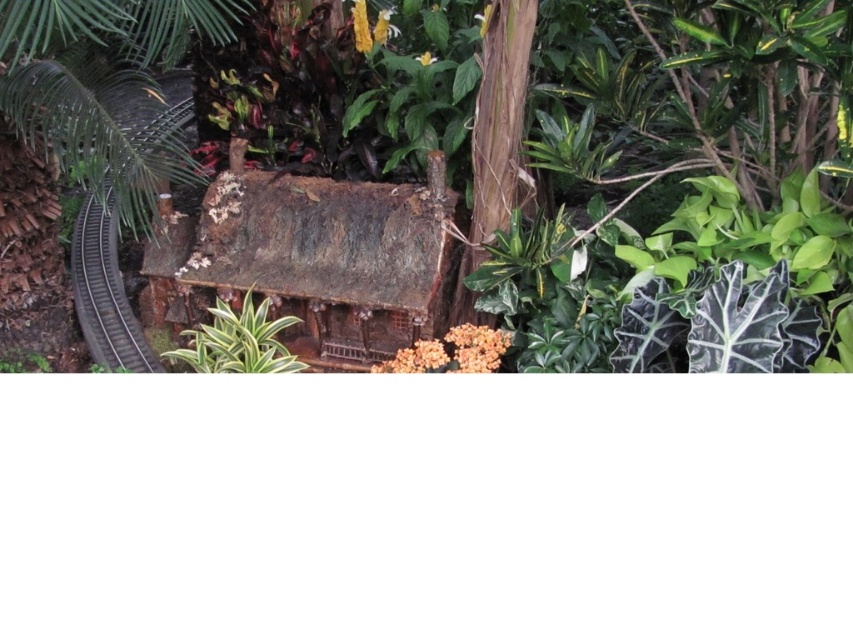
You are a gardener planning to plant a new tree in the garden. You have two options based on the image provided. Which tree, the green leafy tree at left or the brown rough bark tree at center, would require more space due to its size?

The green leafy tree at left requires more space because it is larger in size than the brown rough bark tree at center.

You are designing a garden layout and need to place the rusty wood house at center and the black metal train track at left. Considering their sizes, which object requires more horizontal space in the garden?

The rusty wood house at center requires more horizontal space in the garden because its width surpasses that of the black metal train track at left.

Based on the photo, you are standing in front of the miniature model of the rustic wooden house. There are two points marked on the model, one at coordinates point (x=428, y=225) and the other at point (x=149, y=128). Which of these points is closer to you?

Point (x=428, y=225) is closer to the viewer than point (x=149, y=128).